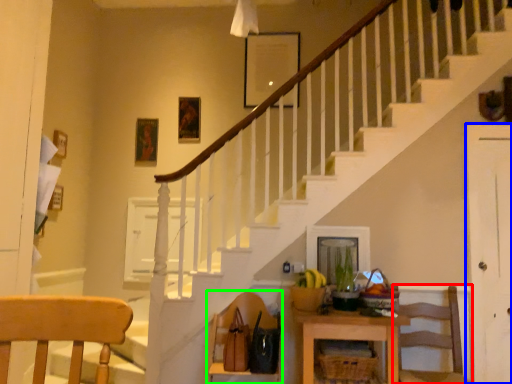
Question: Estimate the real-world distances between objects in this image. Which object is closer to chair (highlighted by a red box), door (highlighted by a blue box) or chair (highlighted by a green box)?

Choices:
 (A) door
 (B) chair

Answer: (A)